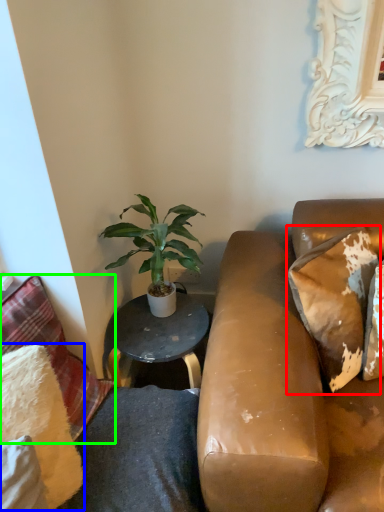
Question: Estimate the real-world distances between objects in this image. Which object is farther from pillow (highlighted by a red box), pillow (highlighted by a blue box) or pillow (highlighted by a green box)?

Choices:
 (A) pillow
 (B) pillow

Answer: (A)